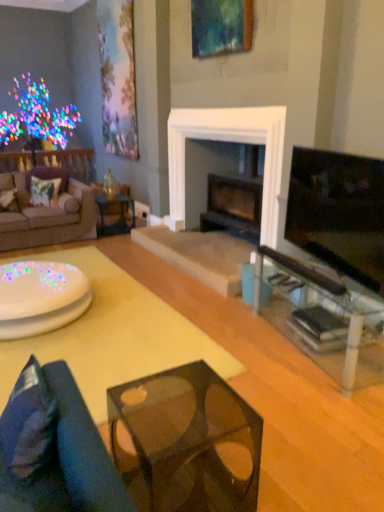
Question: Is translucent glass cube at center, the second table in the right-to-left sequence, to the left or to the right of matte black tv at right in the image?

Choices:
 (A) left
 (B) right

Answer: (A)

Question: From a real-world perspective, is translucent glass cube at center, arranged as the 2th table when viewed from the left, above or below matte black tv at right?

Choices:
 (A) below
 (B) above

Answer: (A)

Question: Estimate the real-world distances between objects in this image. Which object is closer to the blue fabric studio couch at lower left, the 2th studio couch from the left?

Choices:
 (A) metallic glass side table at center
 (B) matte floral painting at upper left, acting as the 1th picture frame starting from the left
 (C) brown fabric couch at left, which ranks as the 1th studio couch in left-to-right order
 (D) velvet green pillow at left, which ranks as the 2th pillow in back-to-front order
 (E) transparent glass table at right, marked as the 3th table in a left-to-right arrangement

Answer: (E)

Question: Estimate the real-world distances between objects in this image. Which object is farther from the white glossy table at lower left, acting as the 3th table starting from the right?

Choices:
 (A) matte black tv at right
 (B) dark blue fabric pillow at lower left, which is counted as the first pillow, starting from the right
 (C) metallic glass side table at center
 (D) translucent glass cube at center, arranged as the 2th table when viewed from the left
 (E) translucent glass coffee table at lower center

Answer: (C)